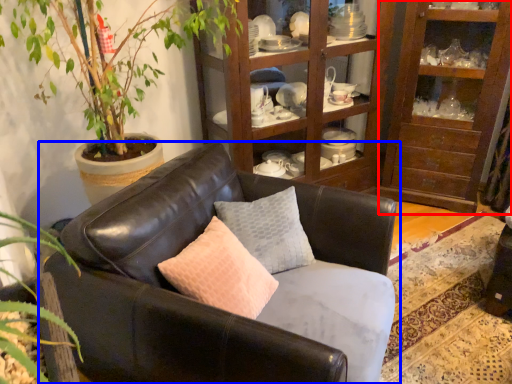
Question: Among these objects, which one is farthest to the camera, shelf (highlighted by a red box) or studio couch (highlighted by a blue box)?

Choices:
 (A) shelf
 (B) studio couch

Answer: (A)